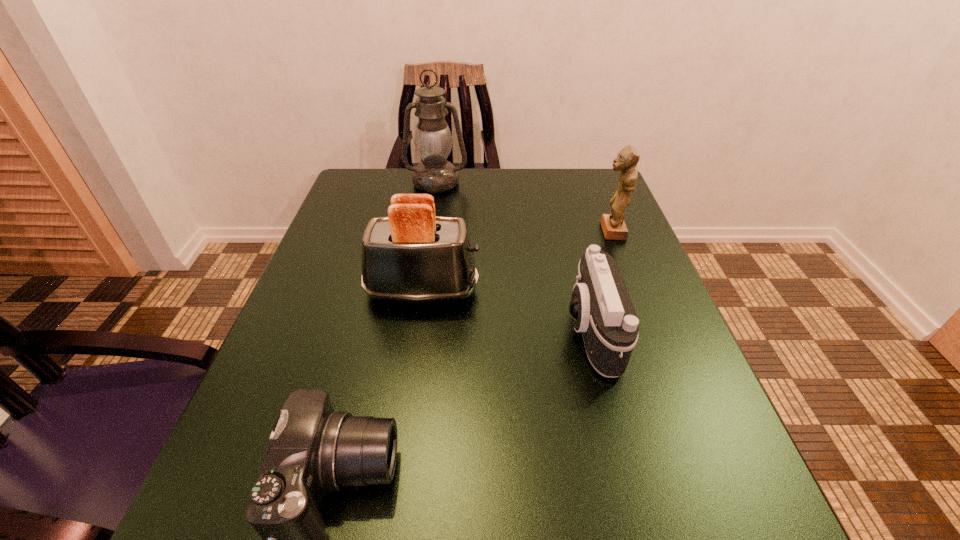
The height and width of the screenshot is (540, 960). Find the location of `object that is at the far left corner`. object that is at the far left corner is located at coordinates (432, 139).

Identify the location of free region at the far edge of the desktop. (467, 211).

I want to click on vacant space at the left edge of the desktop, so click(x=265, y=368).

Find the location of a particular element. This screenshot has height=540, width=960. vacant space at the right edge is located at coordinates (651, 404).

Locate an element on the screen. vacant space at the far left corner of the desktop is located at coordinates (408, 180).

At what (x,y) coordinates should I click in order to perform the action: click on free space at the far right corner. Please return your answer as a coordinate pair (x, y). The width and height of the screenshot is (960, 540). Looking at the image, I should click on point(573,192).

Locate an element on the screen. free region at the near right corner of the desktop is located at coordinates (735, 515).

Where is `free space between the fourth tallest object and the farthest object`? free space between the fourth tallest object and the farthest object is located at coordinates (514, 257).

This screenshot has width=960, height=540. I want to click on vacant space that's between the right camera and the farthest object, so click(514, 257).

In order to click on vacant space that is in between the figurine and the farthest object in this screenshot , I will do coord(523,207).